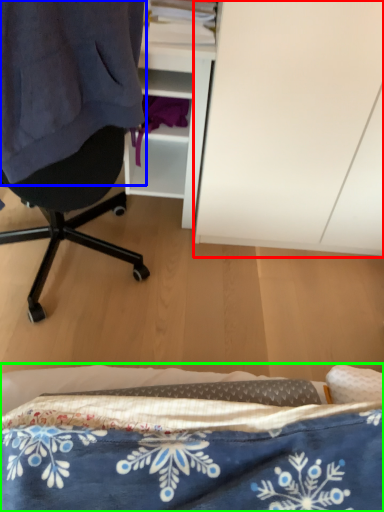
Question: Considering the real-world distances, which object is farthest from cabinetry (highlighted by a red box)? clothing (highlighted by a blue box) or bed (highlighted by a green box)?

Choices:
 (A) clothing
 (B) bed

Answer: (B)